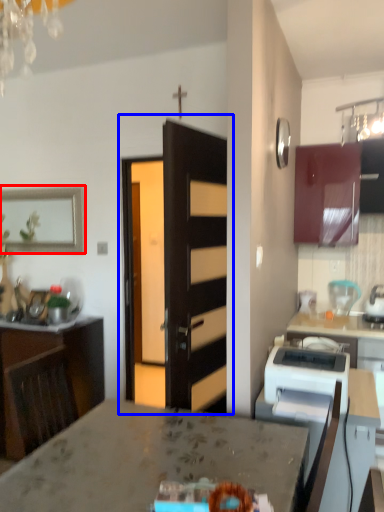
Question: Which object appears farthest to the camera in this image, picture frame (highlighted by a red box) or door (highlighted by a blue box)?

Choices:
 (A) picture frame
 (B) door

Answer: (A)